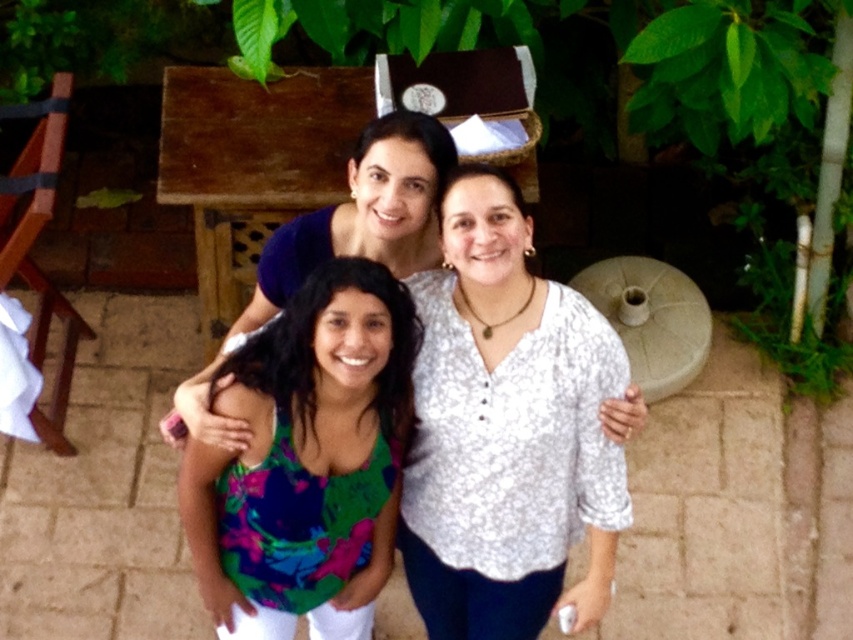
Question: Among these points, which one is nearest to the camera?

Choices:
 (A) (263, 616)
 (B) (488, 198)

Answer: (B)

Question: Is white textured blouse at center wider than multicolored fabric top at center?

Choices:
 (A) yes
 (B) no

Answer: (A)

Question: Which of the following is the farthest from the observer?

Choices:
 (A) multicolored fabric top at center
 (B) white textured blouse at center

Answer: (B)

Question: Can you confirm if white textured blouse at center is positioned below multicolored fabric top at center?

Choices:
 (A) yes
 (B) no

Answer: (B)

Question: Which point is closer to the camera taking this photo?

Choices:
 (A) (325, 493)
 (B) (434, 522)

Answer: (A)

Question: Is white textured blouse at center bigger than multicolored fabric top at center?

Choices:
 (A) no
 (B) yes

Answer: (B)